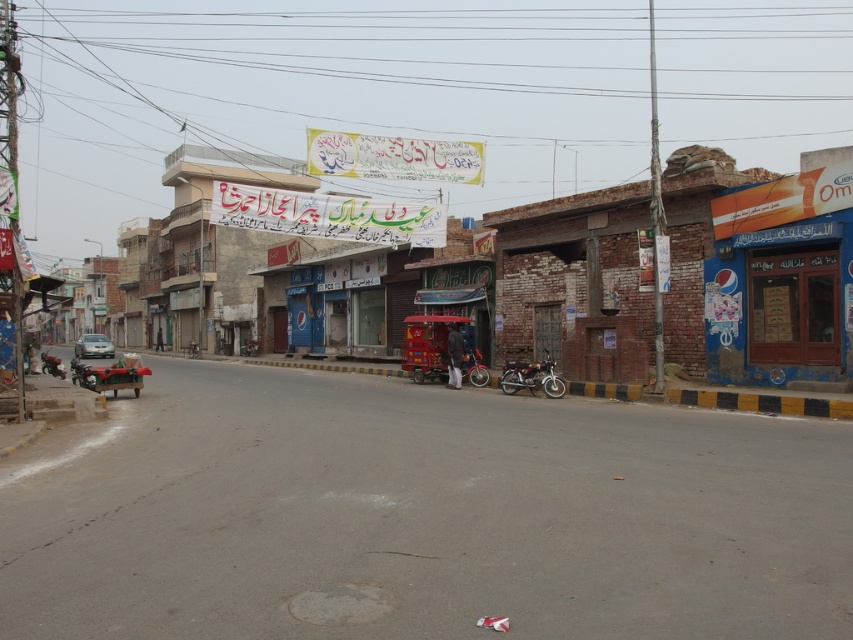
Question: Does shiny chrome motorcycle at center have a smaller size compared to metallic red motorcycle at center?

Choices:
 (A) yes
 (B) no

Answer: (B)

Question: Is silver metallic car at left closer to the viewer compared to shiny metallic motorcycle at lower left?

Choices:
 (A) yes
 (B) no

Answer: (B)

Question: Among these objects, which one is nearest to the camera?

Choices:
 (A) shiny chrome motorcycle at center
 (B) silver metallic car at left
 (C) shiny metallic motorcycle at lower left

Answer: (A)

Question: Which of these objects is positioned closest to the silver metallic car at left?

Choices:
 (A) shiny chrome motorcycle at center
 (B) metallic red motorcycle at center

Answer: (B)

Question: Which point appears closest to the camera in this image?

Choices:
 (A) (486, 381)
 (B) (48, 360)
 (C) (514, 365)
 (D) (103, 356)

Answer: (C)

Question: Observing the image, what is the correct spatial positioning of brick wall at center in reference to silver metallic car at left?

Choices:
 (A) above
 (B) below

Answer: (A)